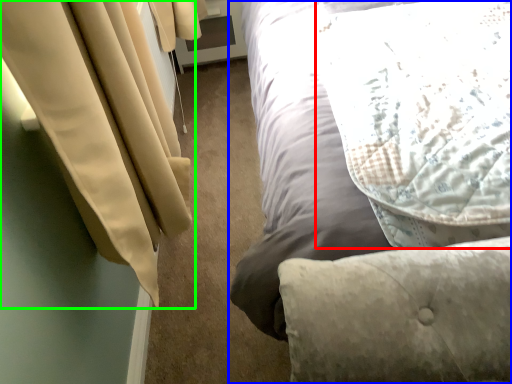
Question: Based on their relative distances, which object is farther from pillow (highlighted by a red box)? Choose from bed (highlighted by a blue box) and curtain (highlighted by a green box).

Choices:
 (A) bed
 (B) curtain

Answer: (B)